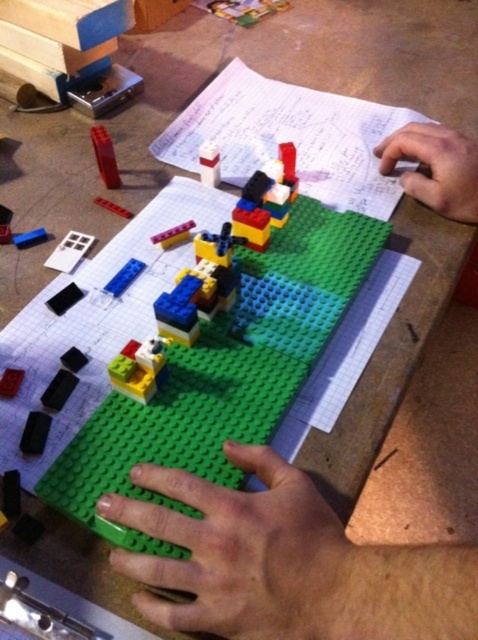
You are trying to place a new LEGO piece between the black matte brick at lower left and the translucent red brick at center. Given their sizes, which brick should you use as a reference to ensure the new piece fits properly?

The black matte brick at lower left has a smaller size compared to the translucent red brick at center. Therefore, you should use the translucent red brick at center as a reference since it is larger and provides more space for the new piece to fit properly.

What is the color of the brick located at point (105, 156) in the LEGO structure?

The brick at point (105, 156) is matte red.

You are trying to place a new LEGO piece between the translucent blue plastic at center and the black matte rectangular block at lower left. Based on their current positions, which object should you move to the left to create space?

The translucent blue plastic at center is positioned on the right side of the black matte rectangular block at lower left. To create space between them, you should move the translucent blue plastic at center to the left.